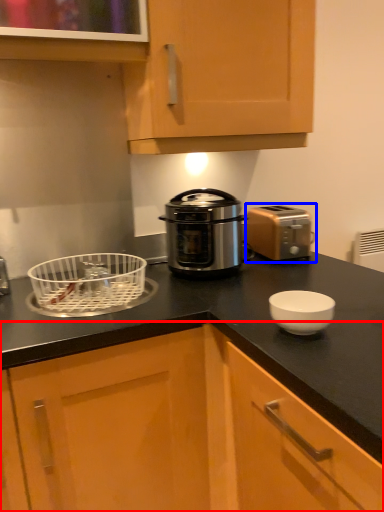
Question: Which object appears farthest to the camera in this image, cabinetry (highlighted by a red box) or toaster (highlighted by a blue box)?

Choices:
 (A) cabinetry
 (B) toaster

Answer: (B)